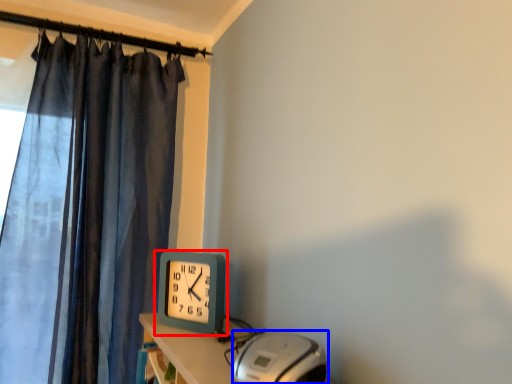
Question: Which point is closer to the camera, wall clock (highlighted by a red box) or equipment (highlighted by a blue box)?

Choices:
 (A) wall clock
 (B) equipment

Answer: (B)